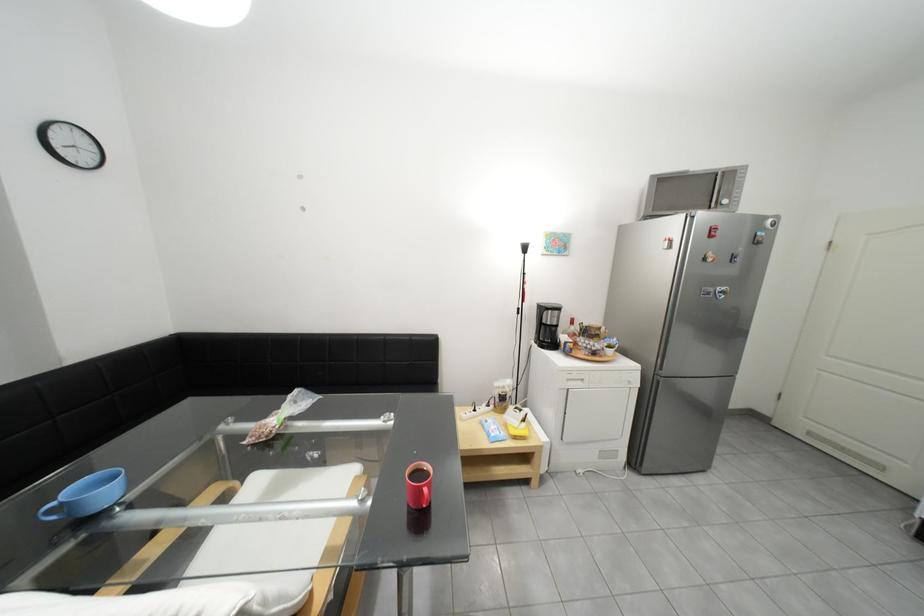
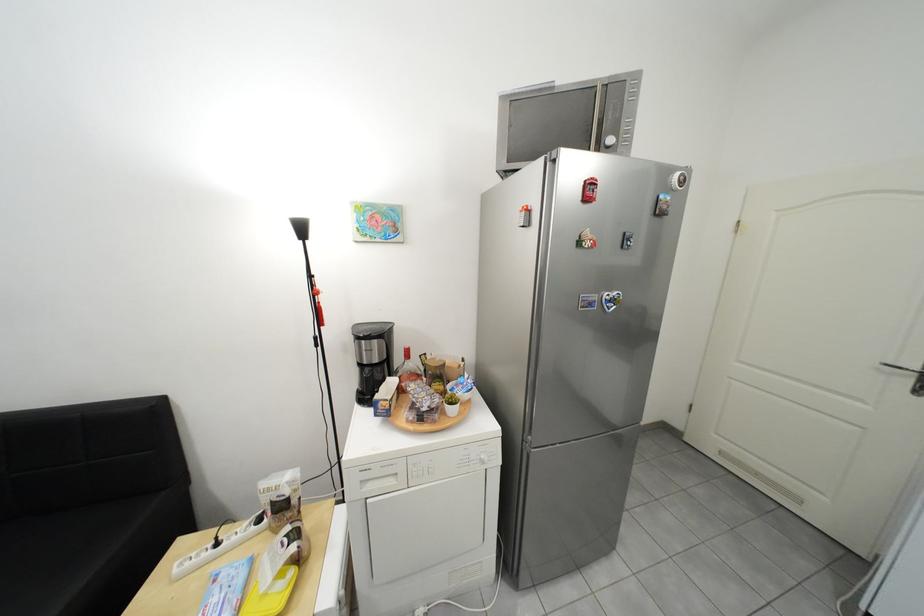
In a continuous first-person perspective shot, in which direction is the camera moving?

The cameraman walked toward right, forward.